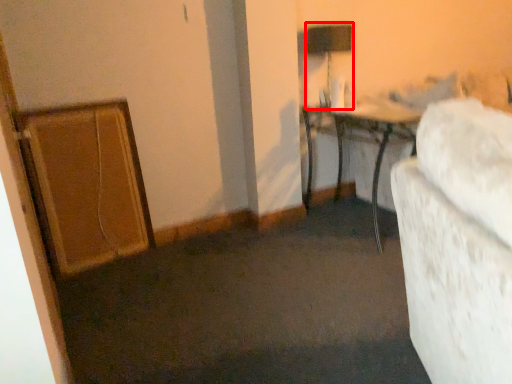
Question: Observing the image, what is the correct spatial positioning of table lamp (annotated by the red box) in reference to table?

Choices:
 (A) right
 (B) left

Answer: (B)